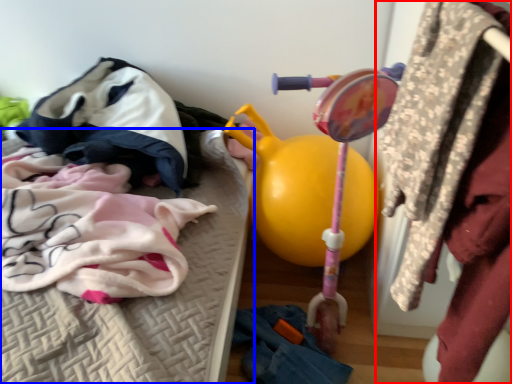
Question: Among these objects, which one is nearest to the camera, closet (highlighted by a red box) or furniture (highlighted by a blue box)?

Choices:
 (A) closet
 (B) furniture

Answer: (A)